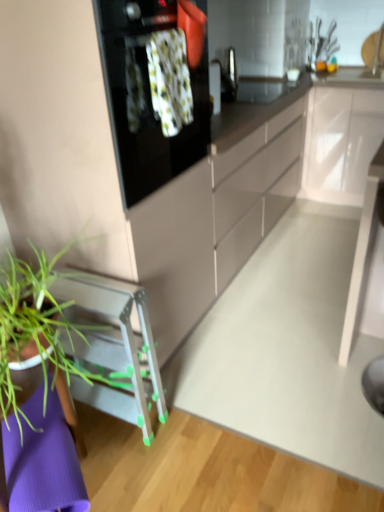
Question: Is white glossy cabinet at upper right looking in the opposite direction of white glossy table at center?

Choices:
 (A) no
 (B) yes

Answer: (A)

Question: Considering the relative positions of white glossy cabinet at upper right and white glossy table at center in the image provided, is white glossy cabinet at upper right to the right of white glossy table at center from the viewer's perspective?

Choices:
 (A) no
 (B) yes

Answer: (B)

Question: Could you tell me if white glossy cabinet at upper right is facing white glossy table at center?

Choices:
 (A) yes
 (B) no

Answer: (A)

Question: Is white glossy cabinet at upper right taller than white glossy table at center?

Choices:
 (A) yes
 (B) no

Answer: (B)

Question: From a real-world perspective, does white glossy cabinet at upper right stand above white glossy table at center?

Choices:
 (A) no
 (B) yes

Answer: (B)

Question: Is white glossy cabinet at upper right spatially inside black glass oven at upper center, or outside of it?

Choices:
 (A) outside
 (B) inside

Answer: (A)

Question: Is white glossy cabinet at upper right in front of or behind black glass oven at upper center in the image?

Choices:
 (A) front
 (B) behind

Answer: (B)

Question: Does point (332, 156) appear closer or farther from the camera than point (196, 67)?

Choices:
 (A) farther
 (B) closer

Answer: (A)

Question: From the image's perspective, is white glossy cabinet at upper right positioned above or below black glass oven at upper center?

Choices:
 (A) below
 (B) above

Answer: (B)

Question: Is black glass oven at upper center in front of or behind white glossy table at center in the image?

Choices:
 (A) behind
 (B) front

Answer: (B)

Question: Would you say black glass oven at upper center is to the left or to the right of white glossy table at center in the picture?

Choices:
 (A) left
 (B) right

Answer: (A)

Question: Is black glass oven at upper center taller or shorter than white glossy table at center?

Choices:
 (A) short
 (B) tall

Answer: (A)

Question: Which is correct: black glass oven at upper center is inside white glossy table at center, or outside of it?

Choices:
 (A) outside
 (B) inside

Answer: (A)

Question: From a real-world perspective, is white glossy cabinet at upper right above or below green plastic stool at lower left?

Choices:
 (A) above
 (B) below

Answer: (A)

Question: Visually, is white glossy cabinet at upper right positioned to the left or to the right of green plastic stool at lower left?

Choices:
 (A) right
 (B) left

Answer: (A)